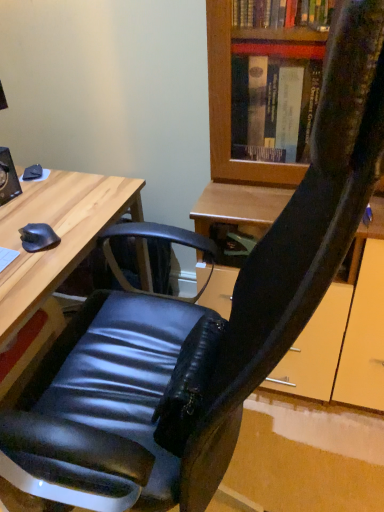
Question: From a real-world perspective, is matte black mouse at left physically located above or below wooden desk at left?

Choices:
 (A) above
 (B) below

Answer: (A)

Question: Which is correct: matte black mouse at left is inside wooden desk at left, or outside of it?

Choices:
 (A) outside
 (B) inside

Answer: (B)

Question: Considering the relative positions of matte black mouse at left and wooden desk at left in the image provided, is matte black mouse at left to the left or to the right of wooden desk at left?

Choices:
 (A) right
 (B) left

Answer: (A)

Question: Which is correct: wooden desk at left is inside matte black mouse at left, or outside of it?

Choices:
 (A) outside
 (B) inside

Answer: (A)

Question: Considering the positions of wooden desk at left and matte black mouse at left in the image, is wooden desk at left bigger or smaller than matte black mouse at left?

Choices:
 (A) small
 (B) big

Answer: (B)

Question: Is wooden desk at left taller or shorter than matte black mouse at left?

Choices:
 (A) short
 (B) tall

Answer: (B)

Question: From a real-world perspective, is wooden desk at left positioned above or below matte black mouse at left?

Choices:
 (A) below
 (B) above

Answer: (A)